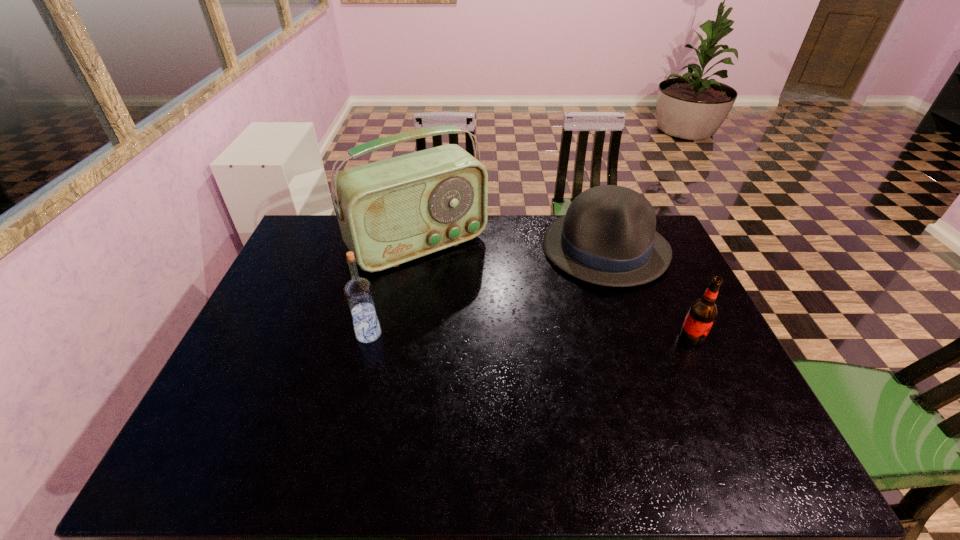
This screenshot has width=960, height=540. In the image, there is a desktop. What are the coordinates of `vacant space at the right edge` in the screenshot? It's located at (666, 271).

Find the location of a particular element. vacant point at the far left corner is located at coordinates (288, 254).

The height and width of the screenshot is (540, 960). I want to click on blank region between the tallest object and the bowler hat, so click(512, 247).

Identify the location of free space between the vodka and the root beer. (530, 336).

At what (x,y) coordinates should I click in order to perform the action: click on empty space that is in between the tallest object and the third shortest object. Please return your answer as a coordinate pair (x, y). The image size is (960, 540). Looking at the image, I should click on (394, 289).

The width and height of the screenshot is (960, 540). I want to click on free spot between the bowler hat and the third shortest object, so click(x=487, y=292).

In order to click on free space between the bowler hat and the vodka in this screenshot , I will do `click(487, 292)`.

Where is `vacant point located between the second tallest object and the bowler hat`? vacant point located between the second tallest object and the bowler hat is located at coordinates pos(487,292).

This screenshot has height=540, width=960. I want to click on vacant space that's between the bowler hat and the second tallest object, so click(487, 292).

You are a GUI agent. You are given a task and a screenshot of the screen. Output one action in this format:
    pyautogui.click(x=<x>, y=<y>)
    Task: Click on the free space between the tallest object and the root beer
    Image resolution: width=960 pixels, height=540 pixels.
    Given the screenshot: What is the action you would take?
    pyautogui.click(x=555, y=291)